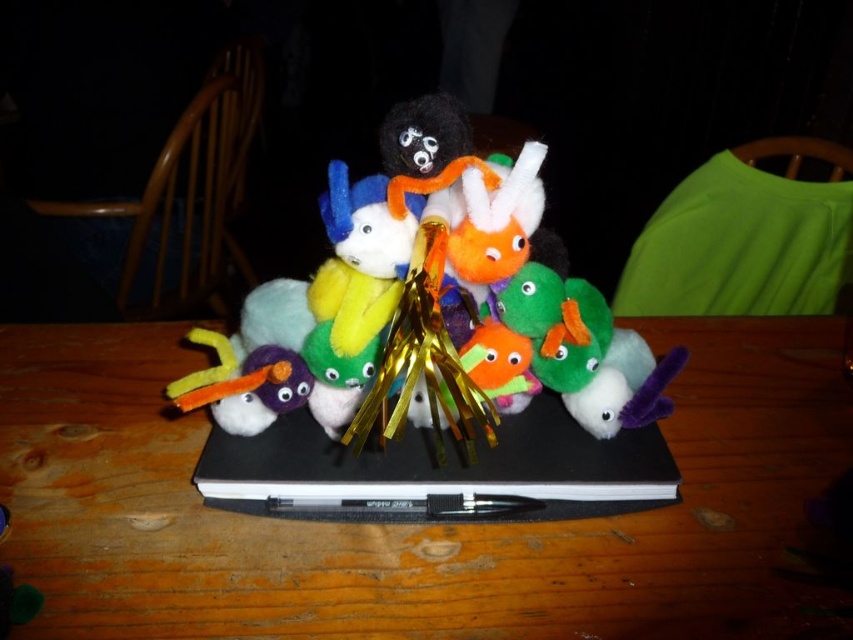
Question: Which of the following is the closest to the observer?

Choices:
 (A) (666, 472)
 (B) (490, 236)

Answer: (B)

Question: Which of these objects is positioned farthest from the black matte laptop at center?

Choices:
 (A) wooden table at center
 (B) fuzzy multicolored stuffed animals at center

Answer: (B)

Question: Does wooden table at center have a lesser width compared to fuzzy multicolored stuffed animals at center?

Choices:
 (A) no
 (B) yes

Answer: (A)

Question: Does wooden table at center have a smaller size compared to fuzzy multicolored stuffed animals at center?

Choices:
 (A) no
 (B) yes

Answer: (A)

Question: Can you confirm if wooden table at center is positioned to the left of fuzzy multicolored stuffed animals at center?

Choices:
 (A) no
 (B) yes

Answer: (A)

Question: Among these objects, which one is farthest from the camera?

Choices:
 (A) black matte laptop at center
 (B) wooden table at center

Answer: (A)